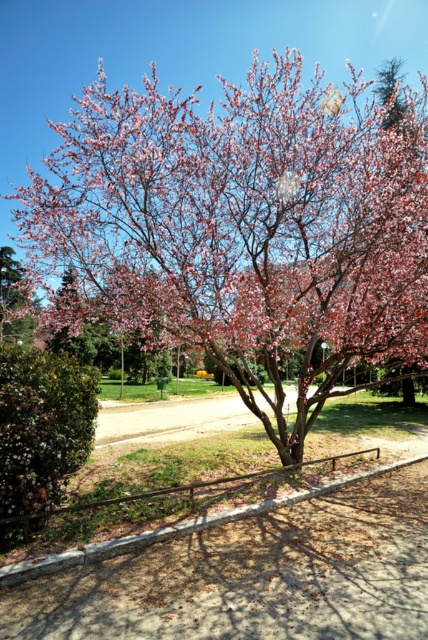
Question: Observing the image, what is the correct spatial positioning of pink matte flower at center in reference to pink matte tree at upper left?

Choices:
 (A) below
 (B) above

Answer: (B)

Question: Is pink matte flower at center bigger than pink matte tree at upper left?

Choices:
 (A) no
 (B) yes

Answer: (B)

Question: Which point is farther from the camera taking this photo?

Choices:
 (A) (314, 314)
 (B) (38, 308)

Answer: (B)

Question: Can you confirm if pink matte flower at center is bigger than pink matte tree at upper left?

Choices:
 (A) yes
 (B) no

Answer: (A)